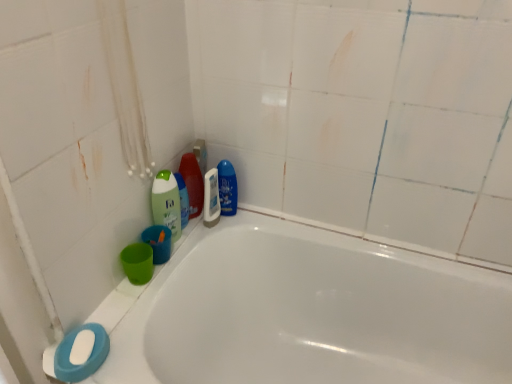
The height and width of the screenshot is (384, 512). What do you see at coordinates (306, 312) in the screenshot?
I see `white glossy bathtub at lower left` at bounding box center [306, 312].

Find the location of a particular element. This screenshot has width=512, height=384. translucent plastic bottle at upper center, which appears as the 2th cleaning product when viewed from the right is located at coordinates (193, 183).

What do you see at coordinates (183, 199) in the screenshot?
I see `green matte bottle at upper left, the third cleaning product viewed from the right` at bounding box center [183, 199].

The width and height of the screenshot is (512, 384). What do you see at coordinates (166, 203) in the screenshot?
I see `green matte bottle at upper left, the first cleaning product positioned from the left` at bounding box center [166, 203].

Measure the distance between white glossy mouthwash at center and camera.

white glossy mouthwash at center and camera are 4.00 feet apart.

You are a GUI agent. You are given a task and a screenshot of the screen. Output one action in this format:
    pyautogui.click(x=<x>, y=<y>)
    Task: Click on the white glossy bathtub at lower left
    This screenshot has height=384, width=512.
    Given the screenshot: What is the action you would take?
    (306, 312)

Considering the sizes of objects white glossy mouthwash at center and white matte soap at lower left in the image provided, who is bigger, white glossy mouthwash at center or white matte soap at lower left?

With larger size is white glossy mouthwash at center.

Would you say white glossy mouthwash at center is outside white matte soap at lower left?

That's correct, white glossy mouthwash at center is outside of white matte soap at lower left.

In the scene shown: Between white glossy mouthwash at center and white matte soap at lower left, which one has larger width?

With larger width is white matte soap at lower left.

Is white glossy mouthwash at center looking in the opposite direction of green matte bottle at upper left, arranged as the fourth cleaning product when viewed from the right?

No, white glossy mouthwash at center's orientation is not away from green matte bottle at upper left, arranged as the fourth cleaning product when viewed from the right.

Based on their sizes in the image, would you say white glossy mouthwash at center is bigger or smaller than green matte bottle at upper left, arranged as the fourth cleaning product when viewed from the right?

In the image, white glossy mouthwash at center appears to be smaller than green matte bottle at upper left, arranged as the fourth cleaning product when viewed from the right.

From the picture: Is white glossy mouthwash at center surrounding green matte bottle at upper left, the first cleaning product positioned from the left?

No, white glossy mouthwash at center does not contain green matte bottle at upper left, the first cleaning product positioned from the left.

What's the angular difference between white glossy mouthwash at center and green matte bottle at upper left, the first cleaning product positioned from the left,'s facing directions?

They differ by 0.0033 degrees in their facing directions.

From the image's perspective, who appears lower, translucent plastic bottle at upper center, which appears as the 2th cleaning product when viewed from the right, or white glossy mouthwash at center?

white glossy mouthwash at center appears lower in the image.

Is translucent plastic bottle at upper center, the third cleaning product when ordered from left to right, turned away from white glossy mouthwash at center?

Correct, translucent plastic bottle at upper center, the third cleaning product when ordered from left to right, is looking away from white glossy mouthwash at center.

Is point (190, 169) positioned in front of point (208, 216)?

Yes, point (190, 169) is in front of point (208, 216).

Is the position of translucent plastic bottle at upper center, the third cleaning product when ordered from left to right, less distant than that of white glossy mouthwash at center?

No, it is behind white glossy mouthwash at center.

Which of these two, white glossy bathtub at lower left or blue glossy bottle at upper center, the 1th cleaning product from the right, is thinner?

With smaller width is blue glossy bottle at upper center, the 1th cleaning product from the right.

Which is further, (x=275, y=322) or (x=221, y=182)?

The point (x=275, y=322) is behind.

Is white glossy bathtub at lower left facing towards blue glossy bottle at upper center, the 1th cleaning product from the right?

No, white glossy bathtub at lower left is not facing towards blue glossy bottle at upper center, the 1th cleaning product from the right.

Between white glossy bathtub at lower left and blue glossy bottle at upper center, which appears as the fourth cleaning product when viewed from the left, which one is positioned behind?

blue glossy bottle at upper center, which appears as the fourth cleaning product when viewed from the left, is further away from the camera.

Between point (166, 182) and point (199, 179), which one is positioned behind?

Point (199, 179)

Based on the photo, can you confirm if green matte bottle at upper left, the first cleaning product positioned from the left, is positioned to the right of translucent plastic bottle at upper center, which appears as the 2th cleaning product when viewed from the right?

In fact, green matte bottle at upper left, the first cleaning product positioned from the left, is to the left of translucent plastic bottle at upper center, which appears as the 2th cleaning product when viewed from the right.

Could you tell me if green matte bottle at upper left, the first cleaning product positioned from the left, is facing translucent plastic bottle at upper center, which appears as the 2th cleaning product when viewed from the right?

No, green matte bottle at upper left, the first cleaning product positioned from the left, is not aimed at translucent plastic bottle at upper center, which appears as the 2th cleaning product when viewed from the right.

Looking at this image, is white glossy bathtub at lower left looking in the opposite direction of white glossy mouthwash at center?

No, white glossy bathtub at lower left is not facing away from white glossy mouthwash at center.

You are a GUI agent. You are given a task and a screenshot of the screen. Output one action in this format:
    pyautogui.click(x=<x>, y=<y>)
    Task: Click on the mouthwash above the white glossy bathtub at lower left (from a real-world perspective)
    This screenshot has height=384, width=512.
    Given the screenshot: What is the action you would take?
    pyautogui.click(x=211, y=198)

Which is farther, (x=462, y=366) or (x=204, y=184)?

The point (x=204, y=184) is more distant.

From a real-world perspective, is white glossy mouthwash at center above or below white glossy bathtub at lower left?

From a real-world perspective, white glossy mouthwash at center is physically above white glossy bathtub at lower left.

From the image's perspective, would you say white glossy mouthwash at center is positioned over white glossy bathtub at lower left?

Yes, from the image's perspective, white glossy mouthwash at center is on top of white glossy bathtub at lower left.

Which of these two, white glossy mouthwash at center or white glossy bathtub at lower left, stands taller?

Standing taller between the two is white glossy bathtub at lower left.

Between white glossy mouthwash at center and white glossy bathtub at lower left, which one is positioned in front?

white glossy bathtub at lower left is more forward.

Find the location of a particular element. soap that appears on the left of white glossy mouthwash at center is located at coordinates (82, 347).

Where is `mouthwash beneath the green matte bottle at upper left, the first cleaning product positioned from the left (from a real-world perspective)`? This screenshot has height=384, width=512. mouthwash beneath the green matte bottle at upper left, the first cleaning product positioned from the left (from a real-world perspective) is located at coordinates (211, 198).

Which object lies nearer to the anchor point white matte soap at lower left, white glossy mouthwash at center or white glossy bathtub at lower left?

Among the two, white glossy mouthwash at center is located nearer to white matte soap at lower left.

Considering their positions, is blue glossy bottle at upper center, the 1th cleaning product from the right, positioned further to green matte bottle at upper left, arranged as the fourth cleaning product when viewed from the right, than white glossy bathtub at lower left?

Among the two, white glossy bathtub at lower left is located further to green matte bottle at upper left, arranged as the fourth cleaning product when viewed from the right.

Based on their spatial positions, is white matte soap at lower left or blue glossy bottle at upper center, the 1th cleaning product from the right, further from white glossy mouthwash at center?

white matte soap at lower left lies further to white glossy mouthwash at center than the other object.

Based on their spatial positions, is blue glossy bottle at upper center, which appears as the fourth cleaning product when viewed from the left, or green matte bottle at upper left, arranged as the fourth cleaning product when viewed from the right, further from white glossy mouthwash at center?

green matte bottle at upper left, arranged as the fourth cleaning product when viewed from the right.

Looking at this image, from the image, which object appears to be nearer to green matte bottle at upper left, the first cleaning product positioned from the left, translucent plastic bottle at upper center, the third cleaning product when ordered from left to right, or white glossy bathtub at lower left?

translucent plastic bottle at upper center, the third cleaning product when ordered from left to right, lies closer to green matte bottle at upper left, the first cleaning product positioned from the left, than the other object.

From the image, which object appears to be nearer to white glossy bathtub at lower left, green matte bottle at upper left, the 2th cleaning product when ordered from left to right, or white glossy mouthwash at center?

Among the two, white glossy mouthwash at center is located nearer to white glossy bathtub at lower left.

Estimate the real-world distances between objects in this image. Which object is closer to translucent plastic bottle at upper center, the third cleaning product when ordered from left to right, white matte soap at lower left or green matte bottle at upper left, the 2th cleaning product when ordered from left to right?

green matte bottle at upper left, the 2th cleaning product when ordered from left to right, is positioned closer to the anchor translucent plastic bottle at upper center, the third cleaning product when ordered from left to right.

From the picture: Considering their positions, is blue glossy bottle at upper center, the 1th cleaning product from the right, positioned further to translucent plastic bottle at upper center, which appears as the 2th cleaning product when viewed from the right, than white glossy mouthwash at center?

Based on the image, blue glossy bottle at upper center, the 1th cleaning product from the right, appears to be further to translucent plastic bottle at upper center, which appears as the 2th cleaning product when viewed from the right.

Where is `mouthwash located between green matte bottle at upper left, arranged as the fourth cleaning product when viewed from the right, and blue glossy bottle at upper center, which appears as the fourth cleaning product when viewed from the left, in the depth direction`? mouthwash located between green matte bottle at upper left, arranged as the fourth cleaning product when viewed from the right, and blue glossy bottle at upper center, which appears as the fourth cleaning product when viewed from the left, in the depth direction is located at coordinates (211, 198).

The width and height of the screenshot is (512, 384). What are the coordinates of `cleaning product between white glossy mouthwash at center and white matte soap at lower left vertically` in the screenshot? It's located at (166, 203).

Image resolution: width=512 pixels, height=384 pixels. Find the location of `soap between white glossy bathtub at lower left and white glossy mouthwash at center in the front-back direction`. soap between white glossy bathtub at lower left and white glossy mouthwash at center in the front-back direction is located at coordinates (82, 347).

The width and height of the screenshot is (512, 384). What are the coordinates of `mouthwash between translucent plastic bottle at upper center, which appears as the 2th cleaning product when viewed from the right, and white matte soap at lower left, in the vertical direction` in the screenshot? It's located at (211, 198).